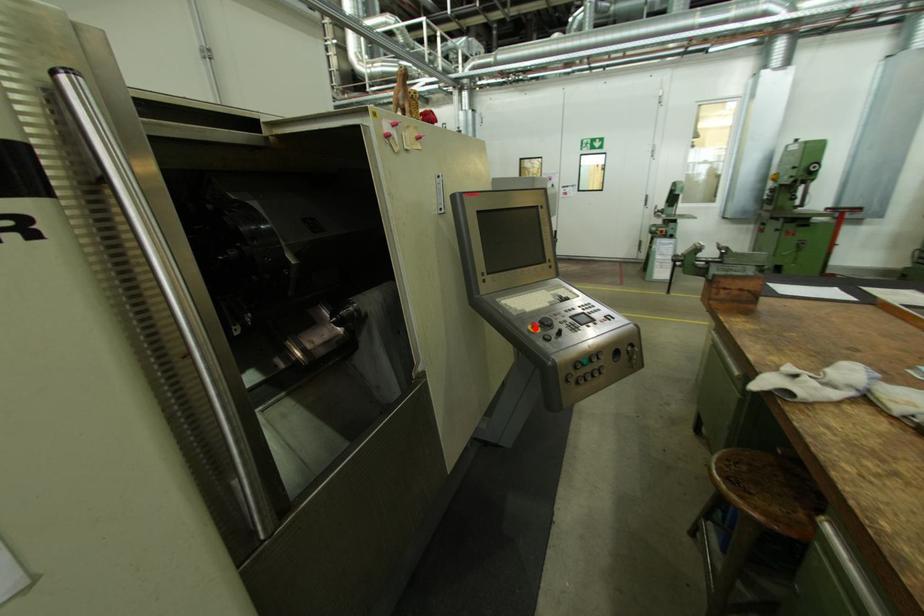
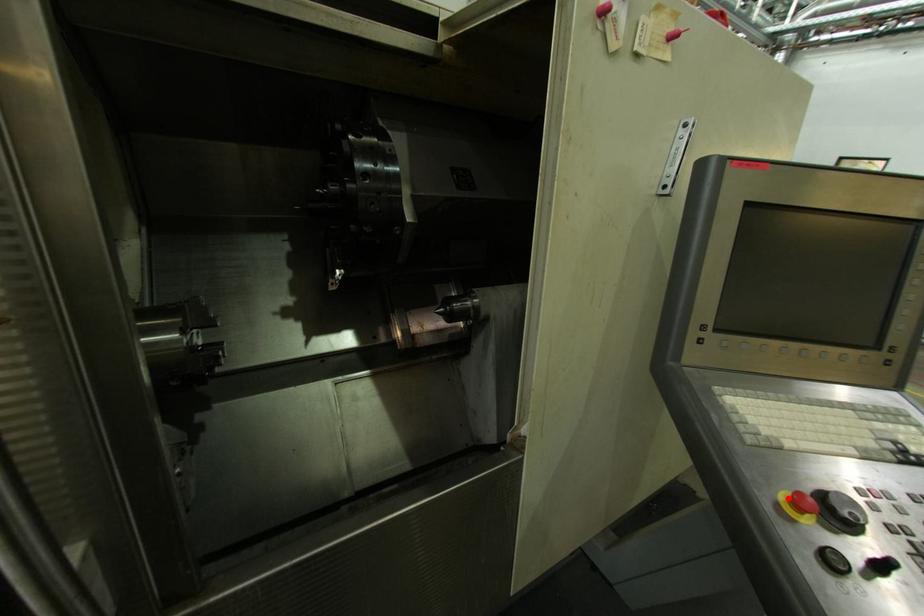
I am providing you with two images of the same scene from different viewpoints. A red point is marked on the first image and another point is marked on the second image. Does the point marked in image1 correspond to the same location as the one in image2?

Yes